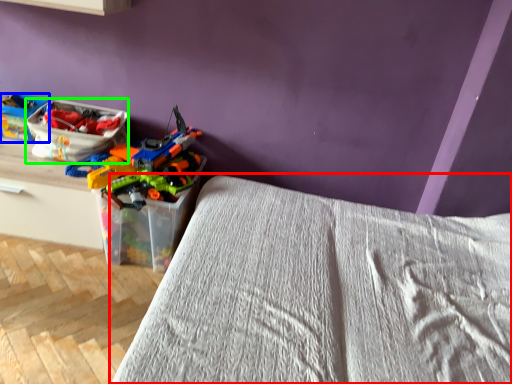
Question: Considering the real-world distances, which object is closest to bed (highlighted by a red box)? kit (highlighted by a blue box) or kit (highlighted by a green box).

Choices:
 (A) kit
 (B) kit

Answer: (B)